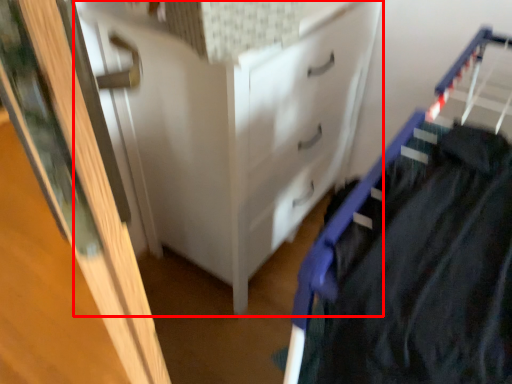
Question: From the image, what is the correct spatial relationship of chest of drawers (annotated by the red box) in relation to door?

Choices:
 (A) right
 (B) left

Answer: (A)